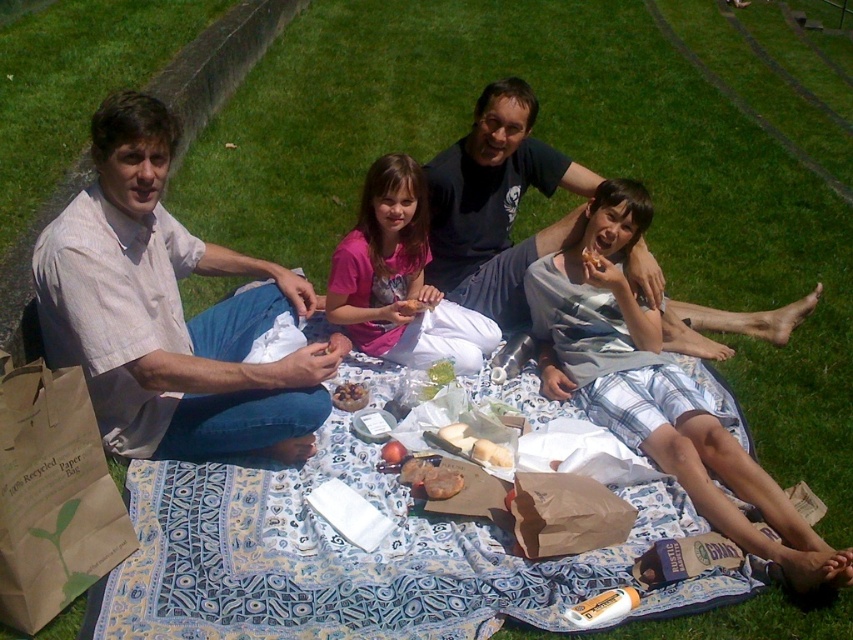
Question: Observing the image, what is the correct spatial positioning of light beige cotton shirt at left in reference to smooth apple at center?

Choices:
 (A) right
 (B) left

Answer: (B)

Question: Is dark blue t-shirt at upper center above white crumbly bread at center?

Choices:
 (A) yes
 (B) no

Answer: (A)

Question: Which object appears closest to the camera in this image?

Choices:
 (A) smooth apple at center
 (B) smooth white cheese at center
 (C) dark blue t-shirt at upper center

Answer: (A)

Question: From the image, what is the correct spatial relationship of smooth chocolate bar at center in relation to golden brown bread at center?

Choices:
 (A) below
 (B) above

Answer: (A)

Question: Which is nearer to the golden brown bread at center?

Choices:
 (A) pink fabric at center
 (B) shiny plastic bag at center
 (C) dark blue t-shirt at upper center

Answer: (C)

Question: Which point appears closest to the camera in this image?

Choices:
 (A) (340, 353)
 (B) (468, 358)
 (C) (474, 456)
 (D) (595, 259)

Answer: (C)